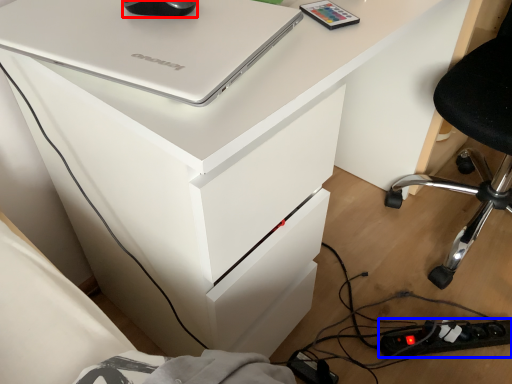
Question: Which point is closer to the camera, mouse (highlighted by a red box) or extension cord (highlighted by a blue box)?

Choices:
 (A) mouse
 (B) extension cord

Answer: (A)